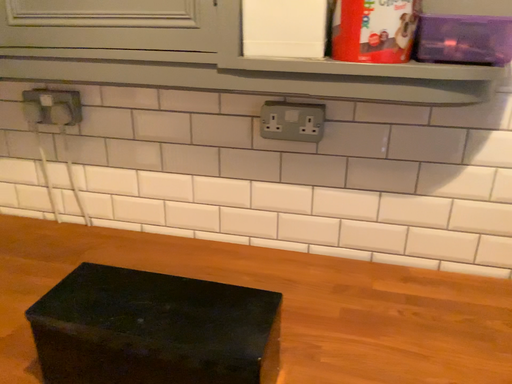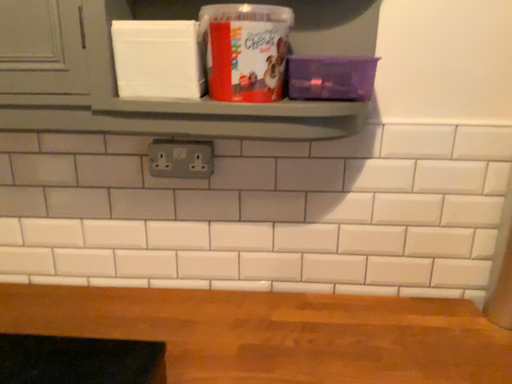
Question: How did the camera likely rotate when shooting the video?

Choices:
 (A) rotated left
 (B) rotated right

Answer: (B)